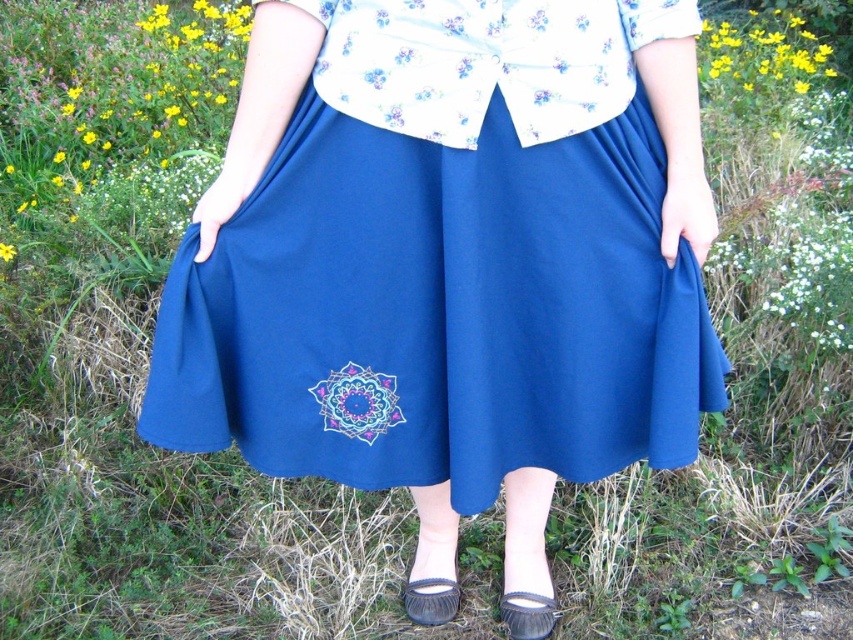
You are a fashion designer observing the outfit of the person in the image. The person is wearing a matte blue skirt at center and a leather moccasin at lower center. Which item is positioned further to the right?

The matte blue skirt at center is positioned further to the right than the leather moccasin at lower center.

You are a fashion designer observing the outfit of the person in the image. You need to decide if the skirt can be paired with a wider belt. Based on the image, can you determine if the matte blue skirt at center is wider than the matte floral blouse at upper center?

The matte blue skirt at center might be wider than matte floral blouse at upper center, so it is possible that the skirt can be paired with a wider belt.

You are standing in a garden and want to take a photo of the person wearing the blue skirt with the mandala design. If you move 2 feet closer to the point at coordinates point (515,387), will you be closer than 3 feet to that point?

The point point (515,387) is initially 4.44 feet from the viewer. Moving 2 feet closer would bring you to 2.44 feet away, which is closer than 3 feet.